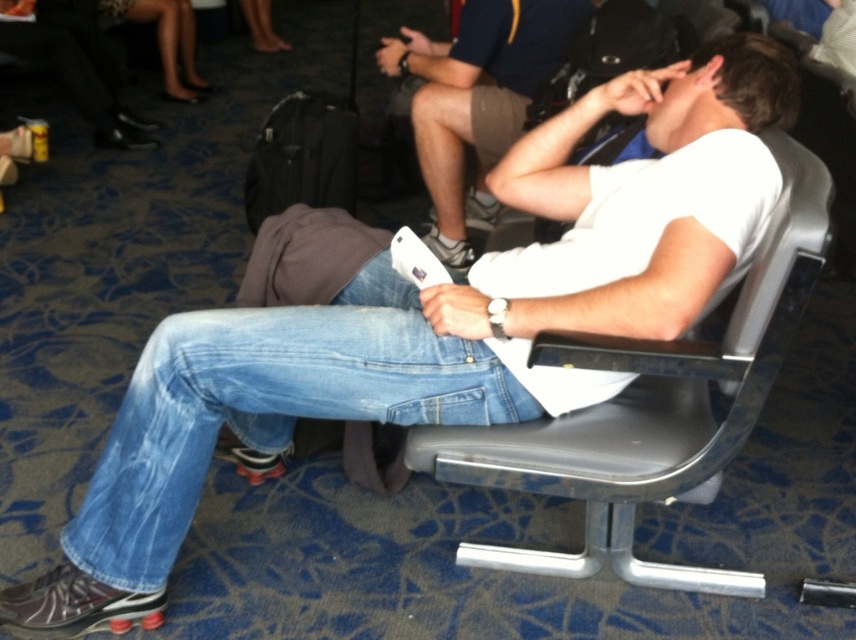
Is denim at center in front of white matte shirt at center?

Yes, denim at center is in front of white matte shirt at center.

Which of these two, denim at center or white matte shirt at center, stands shorter?

Standing shorter between the two is denim at center.

The image size is (856, 640). Describe the element at coordinates (268, 404) in the screenshot. I see `denim at center` at that location.

The width and height of the screenshot is (856, 640). In order to click on denim at center in this screenshot , I will do `click(268, 404)`.

Who is more distant from viewer, (415, 150) or (308, 140)?

Point (415, 150)

Is point (467, 33) positioned in front of point (278, 124)?

Yes, it is in front of point (278, 124).

Who is more forward, (435,99) or (325,122)?

Point (435,99) is more forward.

Where is `white matte shirt at center`? Image resolution: width=856 pixels, height=640 pixels. white matte shirt at center is located at coordinates (477, 99).

Who is positioned more to the left, denim at center or metallic gray chair at center?

From the viewer's perspective, denim at center appears more on the left side.

Locate an element on the screen. denim at center is located at coordinates (268, 404).

Locate an element on the screen. denim at center is located at coordinates (268, 404).